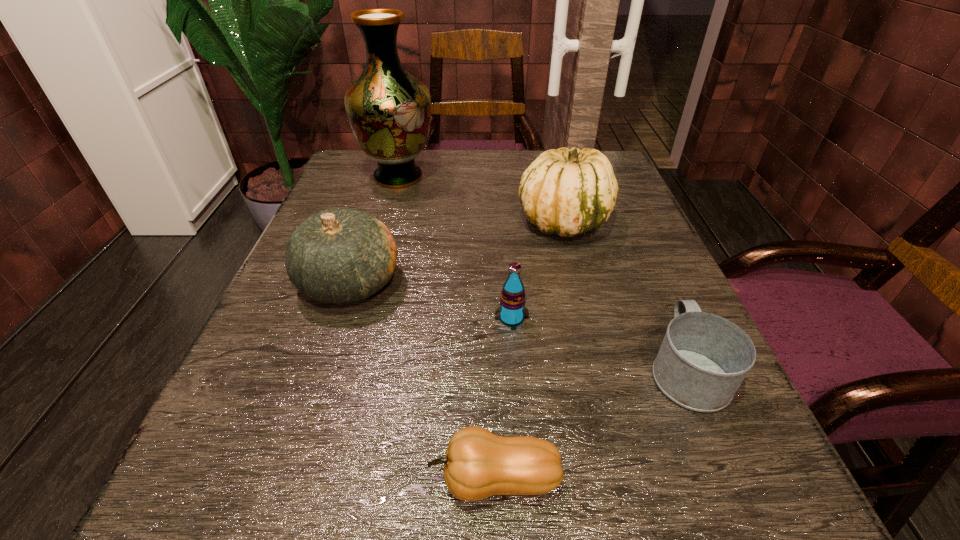
Identify the location of free space at the near left corner of the desktop. (287, 525).

This screenshot has width=960, height=540. Find the location of `free space that is in between the vase and the nearest object`. free space that is in between the vase and the nearest object is located at coordinates (446, 328).

Locate an element on the screen. This screenshot has width=960, height=540. vacant area that lies between the farthest gourd and the vase is located at coordinates (481, 199).

You are a GUI agent. You are given a task and a screenshot of the screen. Output one action in this format:
    pyautogui.click(x=<x>, y=<y>)
    Task: Click on the empty space that is in between the mug and the fourth tallest object
    The height and width of the screenshot is (540, 960).
    Given the screenshot: What is the action you would take?
    pyautogui.click(x=599, y=343)

The height and width of the screenshot is (540, 960). What are the coordinates of `vacant region between the farthest gourd and the soda` in the screenshot? It's located at (538, 269).

Where is `free space between the farthest gourd and the shortest gourd`? free space between the farthest gourd and the shortest gourd is located at coordinates (529, 350).

This screenshot has width=960, height=540. I want to click on vacant point located between the third shortest object and the tallest object, so click(x=455, y=247).

Image resolution: width=960 pixels, height=540 pixels. In order to click on free space between the farthest gourd and the mug in this screenshot , I will do `click(625, 295)`.

In order to click on free area in between the vase and the fourth tallest object in this screenshot , I will do `click(455, 247)`.

Where is `free spot between the second nearest object and the fourth tallest object`? The image size is (960, 540). free spot between the second nearest object and the fourth tallest object is located at coordinates (599, 343).